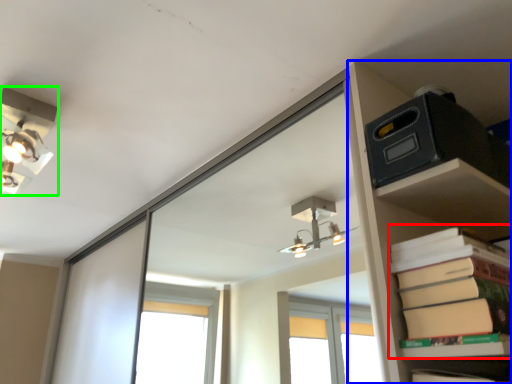
Question: Estimate the real-world distances between objects in this image. Which object is farther from paperback book (highlighted by a red box), shelf (highlighted by a blue box) or lamp (highlighted by a green box)?

Choices:
 (A) shelf
 (B) lamp

Answer: (B)